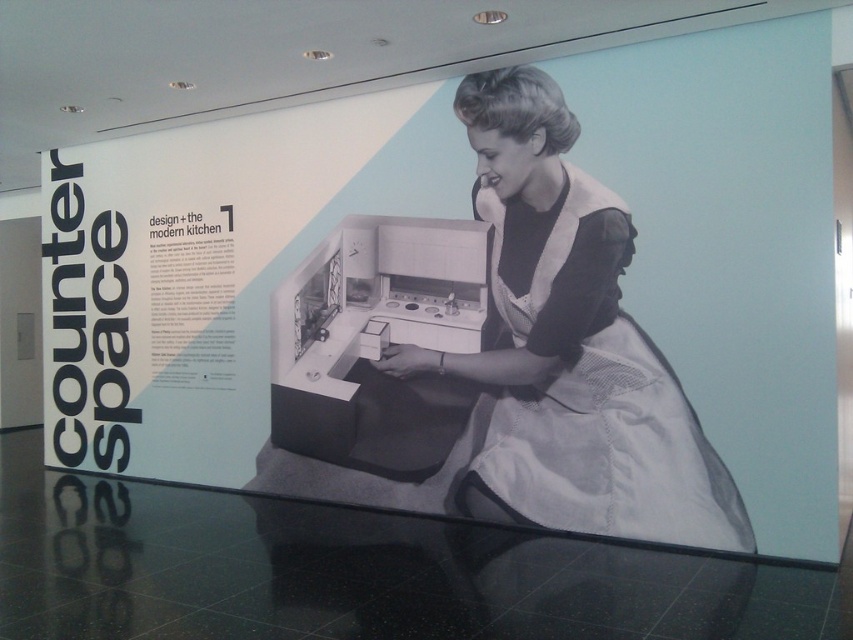
Which is behind, point (190, 556) or point (577, 246)?

The point (577, 246) is more distant.

Measure the distance between transparent glass table at lower center and camera.

transparent glass table at lower center is 3.62 meters from camera.

Is point (167, 621) more distant than point (560, 208)?

That is False.

Where is `transparent glass table at lower center`? The image size is (853, 640). transparent glass table at lower center is located at coordinates (357, 572).

Which is above, transparent glass table at lower center or metallic stove at center?

metallic stove at center is above.

Does point (231, 570) come farther from viewer compared to point (360, 218)?

No, (231, 570) is in front of (360, 218).

Locate an element on the screen. This screenshot has width=853, height=640. transparent glass table at lower center is located at coordinates (357, 572).

Between black fabric apron at center and metallic stove at center, which one is positioned higher?

Positioned higher is black fabric apron at center.

Is point (537, 506) farther from viewer compared to point (363, 237)?

No.

Locate an element on the screen. The image size is (853, 640). black fabric apron at center is located at coordinates (572, 346).